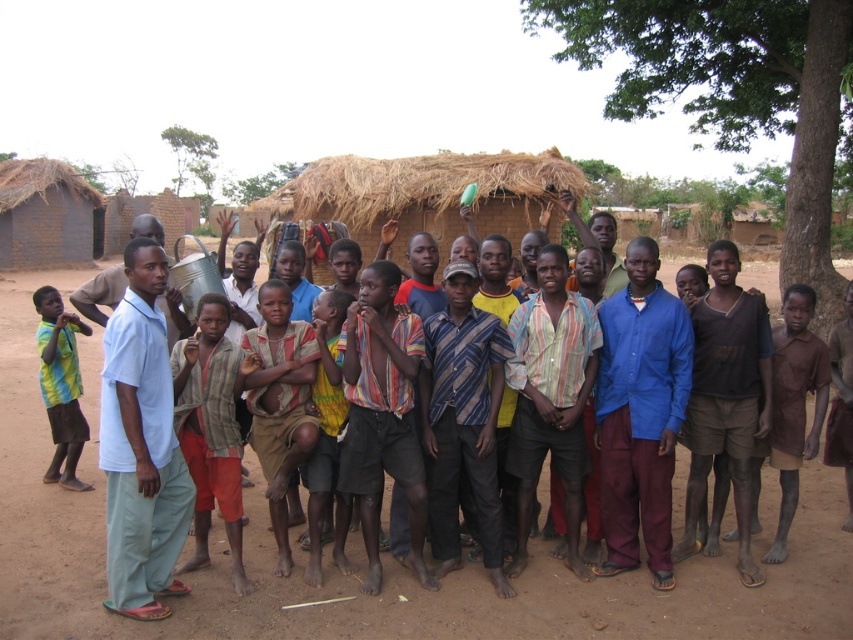
Between green leafy tree at right and striped fabric shirt at center, which one appears on the right side from the viewer's perspective?

From the viewer's perspective, green leafy tree at right appears more on the right side.

Which is in front, point (837, 301) or point (222, 387)?

Point (222, 387) is more forward.

Which is behind, point (761, 99) or point (230, 477)?

Point (761, 99)

Find the location of `green leafy tree at right`. green leafy tree at right is located at coordinates (730, 90).

Measure the distance between brown dirt field at center and camera.

brown dirt field at center is 4.15 meters from camera.

Is brown dirt field at center below green leafy tree at upper left?

Yes.

The image size is (853, 640). What do you see at coordinates (363, 556) in the screenshot?
I see `brown dirt field at center` at bounding box center [363, 556].

Identify the location of brown dirt field at center. The height and width of the screenshot is (640, 853). (363, 556).

Is green leafy tree at right positioned at the back of yellow-green striped shirt at left?

Yes.

Looking at this image, is green leafy tree at right positioned in front of yellow-green striped shirt at left?

No, it is not.

Identify the location of green leafy tree at right. (730, 90).